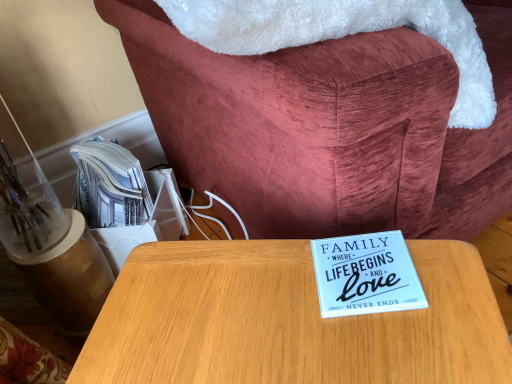
Measure the distance between point (128, 353) and camera.

The depth of point (128, 353) is 16.26 inches.

Describe the element at coordinates (289, 321) in the screenshot. Image resolution: width=512 pixels, height=384 pixels. I see `wooden table at center` at that location.

Locate an element on the screen. wooden table at center is located at coordinates (289, 321).

What do you see at coordinates (329, 127) in the screenshot? I see `wooden table at center` at bounding box center [329, 127].

Find the location of a particular element. This screenshot has width=512, height=384. wooden table at center is located at coordinates (329, 127).

This screenshot has height=384, width=512. In order to click on wooden table at center in this screenshot , I will do `click(289, 321)`.

Does wooden table at center appear on the right side of wooden table at center?

No.

Based on the photo, considering the positions of objects wooden table at center and wooden table at center in the image provided, who is in front, wooden table at center or wooden table at center?

Positioned in front is wooden table at center.

Is point (149, 289) closer to viewer compared to point (402, 195)?

Yes, point (149, 289) is closer to viewer.

From the image's perspective, does wooden table at center appear lower than wooden table at center?

Yes, from the image's perspective, wooden table at center is beneath wooden table at center.

From a real-world perspective, which is physically below, wooden table at center or wooden table at center?

wooden table at center.

Considering the relative sizes of wooden table at center and wooden table at center in the image provided, is wooden table at center wider than wooden table at center?

No, wooden table at center is not wider than wooden table at center.

Considering the sizes of wooden table at center and wooden table at center in the image, is wooden table at center taller or shorter than wooden table at center?

wooden table at center is taller than wooden table at center.

Between wooden table at center and wooden table at center, which one has smaller size?

Smaller between the two is wooden table at center.

Is wooden table at center not within wooden table at center?

Indeed, wooden table at center is completely outside wooden table at center.

Is wooden table at center far away from wooden table at center?

They are positioned close to each other.

Is wooden table at center at the back of wooden table at center?

That's not correct — wooden table at center is not looking away from wooden table at center.

Can you tell me how much wooden table at center and wooden table at center differ in facing direction?

29.4 degrees.

How far apart are wooden table at center and wooden table at center?

wooden table at center and wooden table at center are 13.28 inches apart from each other.

Where is `table located on the left of wooden table at center`? This screenshot has height=384, width=512. table located on the left of wooden table at center is located at coordinates (289, 321).

Considering the positions of objects wooden table at center and wooden table at center in the image provided, who is more to the left, wooden table at center or wooden table at center?

wooden table at center.

In the image, is wooden table at center positioned in front of or behind wooden table at center?

wooden table at center is behind wooden table at center.

Is point (510, 85) positioned behind point (118, 310)?

Yes, it is.

From the image's perspective, is wooden table at center over wooden table at center?

Yes, from the image's perspective, wooden table at center is over wooden table at center.

From a real-world perspective, is wooden table at center positioned above or below wooden table at center?

wooden table at center is above wooden table at center.

Can you confirm if wooden table at center is thinner than wooden table at center?

Incorrect, the width of wooden table at center is not less than that of wooden table at center.

Considering the relative sizes of wooden table at center and wooden table at center in the image provided, is wooden table at center taller than wooden table at center?

In fact, wooden table at center may be shorter than wooden table at center.

Considering the relative sizes of wooden table at center and wooden table at center in the image provided, is wooden table at center bigger than wooden table at center?

Yes.

Is wooden table at center inside the boundaries of wooden table at center, or outside?

wooden table at center is not enclosed by wooden table at center.

Are wooden table at center and wooden table at center far apart?

No.

Does wooden table at center turn towards wooden table at center?

No, wooden table at center is not turned towards wooden table at center.

Can you tell me how much wooden table at center and wooden table at center differ in facing direction?

There is a 29.4-degree angle between the facing directions of wooden table at center and wooden table at center.

Locate an element on the screen. The height and width of the screenshot is (384, 512). table on the left of wooden table at center is located at coordinates (289, 321).

Locate an element on the screen. table below the wooden table at center (from the image's perspective) is located at coordinates (289, 321).

Locate an element on the screen. furniture that is above the wooden table at center (from the image's perspective) is located at coordinates (329, 127).